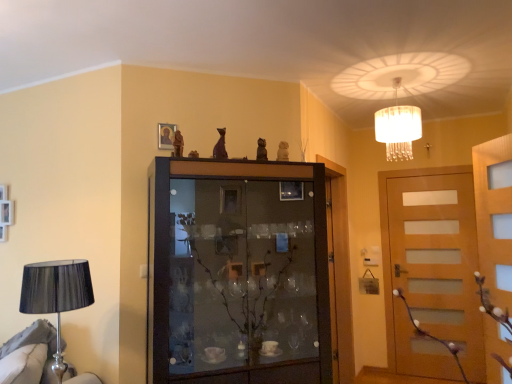
Question: From a real-world perspective, is wooden door at center, the second door viewed from the right, physically below translucent glass chandelier at upper center?

Choices:
 (A) no
 (B) yes

Answer: (B)

Question: From the image's perspective, would you say wooden door at center, positioned as the 1th door in left-to-right order, is shown under translucent glass chandelier at upper center?

Choices:
 (A) no
 (B) yes

Answer: (B)

Question: Does wooden door at center, positioned as the 1th door in left-to-right order, have a lesser width compared to translucent glass chandelier at upper center?

Choices:
 (A) no
 (B) yes

Answer: (B)

Question: Is wooden door at center, positioned as the 1th door in left-to-right order, located outside translucent glass chandelier at upper center?

Choices:
 (A) no
 (B) yes

Answer: (B)

Question: Does wooden door at center, the second door viewed from the right, have a lesser height compared to translucent glass chandelier at upper center?

Choices:
 (A) yes
 (B) no

Answer: (B)

Question: Looking at their shapes, would you say wooden door at center, positioned as the 1th door in left-to-right order, is wider or thinner than metallic lampshade at left?

Choices:
 (A) thin
 (B) wide

Answer: (A)

Question: Is wooden door at center, the second door viewed from the right, inside or outside of metallic lampshade at left?

Choices:
 (A) inside
 (B) outside

Answer: (B)

Question: Is wooden door at center, the second door viewed from the right, to the left or to the right of metallic lampshade at left in the image?

Choices:
 (A) right
 (B) left

Answer: (A)

Question: Is point click(346, 365) positioned closer to the camera than point click(41, 360)?

Choices:
 (A) closer
 (B) farther

Answer: (B)

Question: Looking at their shapes, would you say brown wooden cupboard at center is wider or thinner than wooden door at center, the second door viewed from the right?

Choices:
 (A) thin
 (B) wide

Answer: (B)

Question: Would you say brown wooden cupboard at center is to the left or to the right of wooden door at center, positioned as the 1th door in left-to-right order, in the picture?

Choices:
 (A) left
 (B) right

Answer: (A)

Question: From the image's perspective, is brown wooden cupboard at center positioned above or below wooden door at center, positioned as the 1th door in left-to-right order?

Choices:
 (A) below
 (B) above

Answer: (B)

Question: Is brown wooden cupboard at center spatially inside wooden door at center, the second door viewed from the right, or outside of it?

Choices:
 (A) inside
 (B) outside

Answer: (B)

Question: From the image's perspective, relative to metallic lampshade at left, is translucent glass chandelier at upper center above or below?

Choices:
 (A) above
 (B) below

Answer: (A)

Question: Visually, is translucent glass chandelier at upper center positioned to the left or to the right of metallic lampshade at left?

Choices:
 (A) right
 (B) left

Answer: (A)